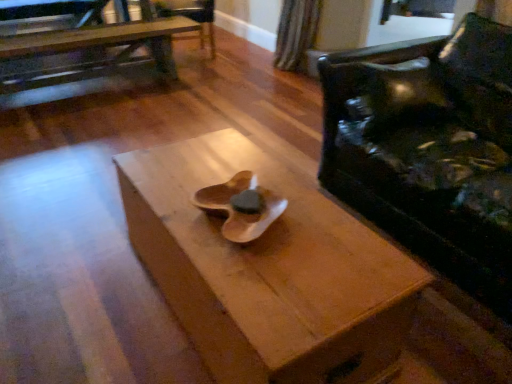
This screenshot has width=512, height=384. I want to click on vacant area located to the right-hand side of wooden armchair at upper center, so click(244, 60).